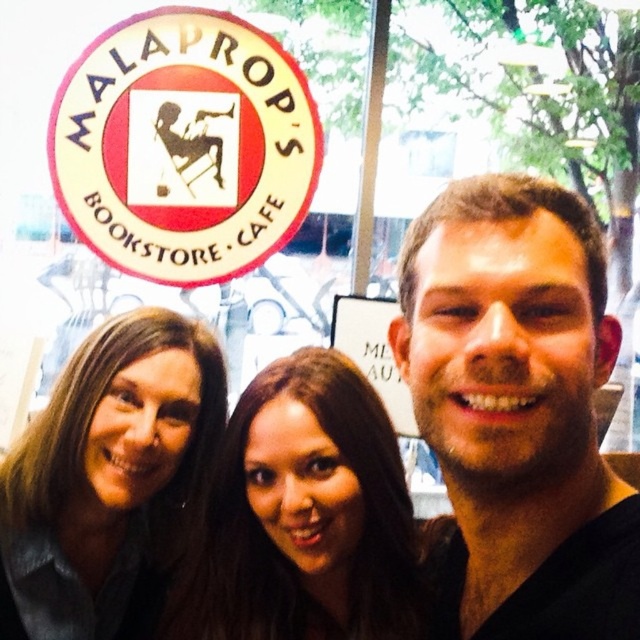
You are a photographer trying to frame a shot of the black matte face at center and the brown hair at upper left. Based on their sizes, which object should you adjust your camera to focus on first to ensure both fit in the frame?

Result: The black matte face at center has a lesser width compared to brown hair at upper left, so you should focus on the brown hair at upper left first to ensure both fit in the frame.

You are a photographer trying to adjust the camera focus. You notice two features in the scene, the black matte face at center and the brown hair at upper left. Which one is shorter in height?

The black matte face at center has a lesser height compared to the brown hair at upper left, so the black matte face at center is shorter in height.